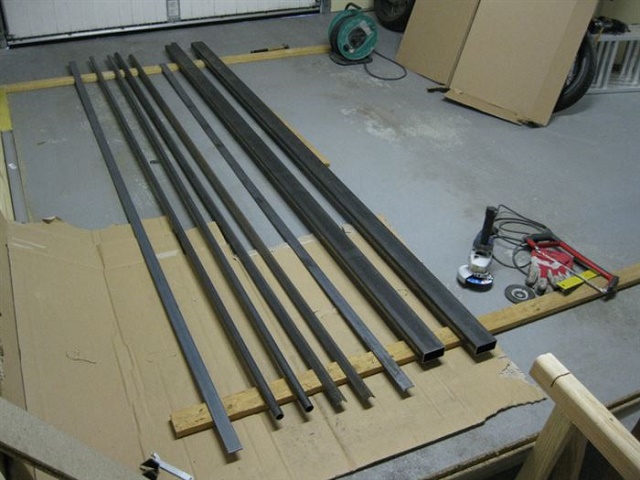
Locate an element on the screen. grey metal around white door is located at coordinates (177, 21).